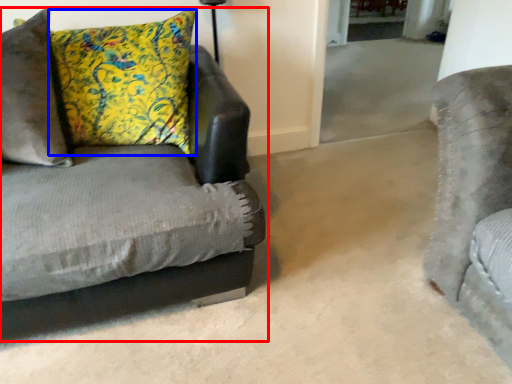
Question: Among these objects, which one is farthest to the camera, studio couch (highlighted by a red box) or pillow (highlighted by a blue box)?

Choices:
 (A) studio couch
 (B) pillow

Answer: (B)